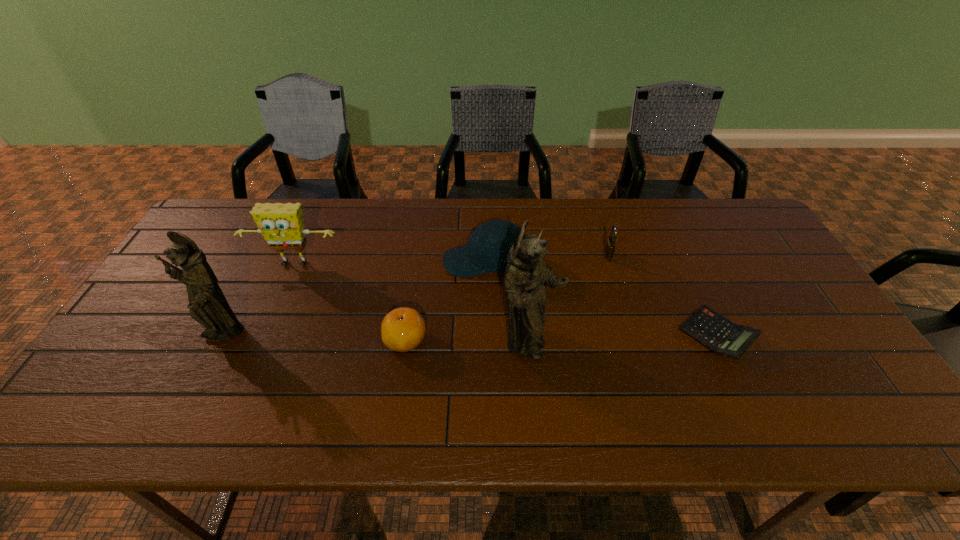
You are a GUI agent. You are given a task and a screenshot of the screen. Output one action in this format:
    pyautogui.click(x=<x>, y=<y>)
    Task: Click on the clementine
    
    Given the screenshot: What is the action you would take?
    pyautogui.click(x=402, y=329)

The width and height of the screenshot is (960, 540). Find the location of `the third object from left to right`. the third object from left to right is located at coordinates (402, 329).

You are a GUI agent. You are given a task and a screenshot of the screen. Output one action in this format:
    pyautogui.click(x=<x>, y=<y>)
    Task: Click on the vacant point located on the front-facing side of the shorter figurine
    
    Given the screenshot: What is the action you would take?
    pyautogui.click(x=198, y=382)

Image resolution: width=960 pixels, height=540 pixels. I want to click on free location located 0.220m on the front-facing side of the tallest object, so click(x=646, y=345).

I want to click on free region located on the back of the third shortest object, so click(603, 239).

Identify the location of free space located on the face of the sponge. [x=247, y=377].

This screenshot has width=960, height=540. Identify the location of free location located on the right of the calculator. (824, 335).

The height and width of the screenshot is (540, 960). I want to click on vacant space located on the front-facing side of the fourth tallest object, so click(x=364, y=262).

Find the location of a particular element. vacant region located 0.330m on the front-facing side of the fourth tallest object is located at coordinates (333, 262).

The width and height of the screenshot is (960, 540). I want to click on free space located 0.090m on the front-facing side of the fourth tallest object, so click(x=414, y=262).